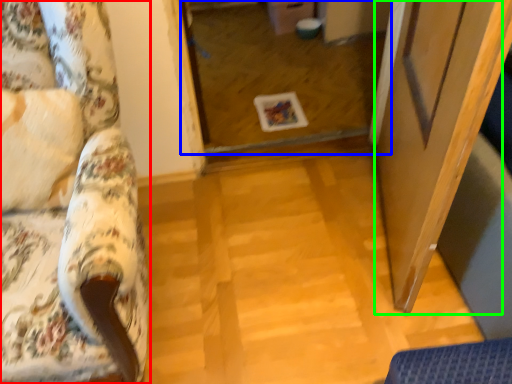
Question: Which object is positioned farthest from furniture (highlighted by a red box)? Select from glass door (highlighted by a blue box) and screen door (highlighted by a green box).

Choices:
 (A) glass door
 (B) screen door

Answer: (A)